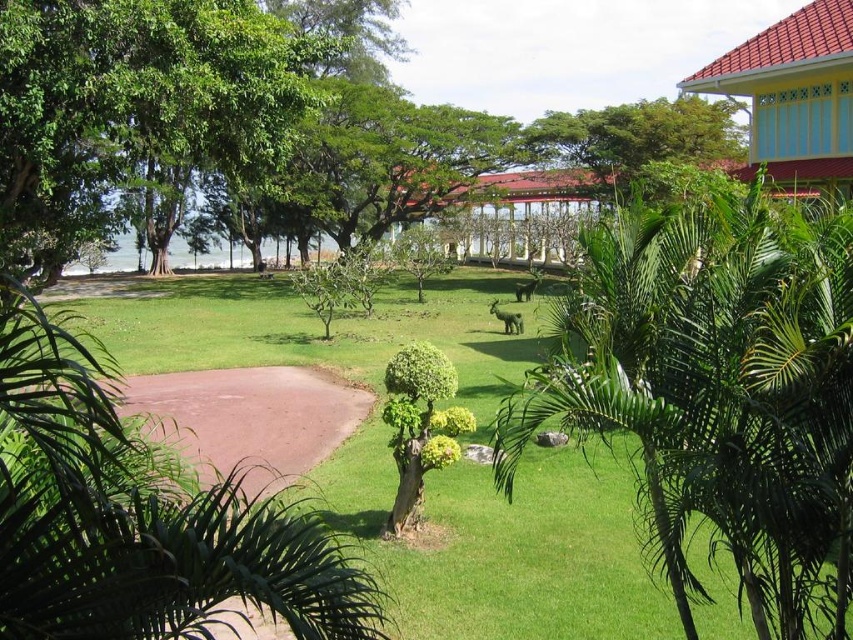
You are standing in the park and want to take a photo of the point at coordinates (750,528). If you are 3.73 meters away from it, will you need to move closer or farther to get it in focus?

The point at coordinates (750,528) is 3.73 meters away from the camera. To get it in focus, you should move closer to reduce the distance between yourself and the point.

From the picture: You are standing at the point marked by coordinates point [720,394] in the scene. What object is located at this point?

The point [720,394] corresponds to the green leafy palm tree at center right.